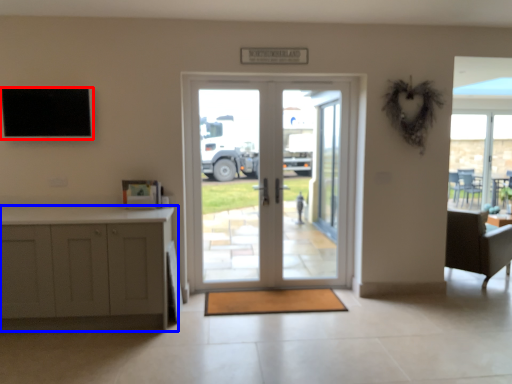
Question: Which of the following is the closest to the observer, screen (highlighted by a red box) or cabinetry (highlighted by a blue box)?

Choices:
 (A) screen
 (B) cabinetry

Answer: (B)